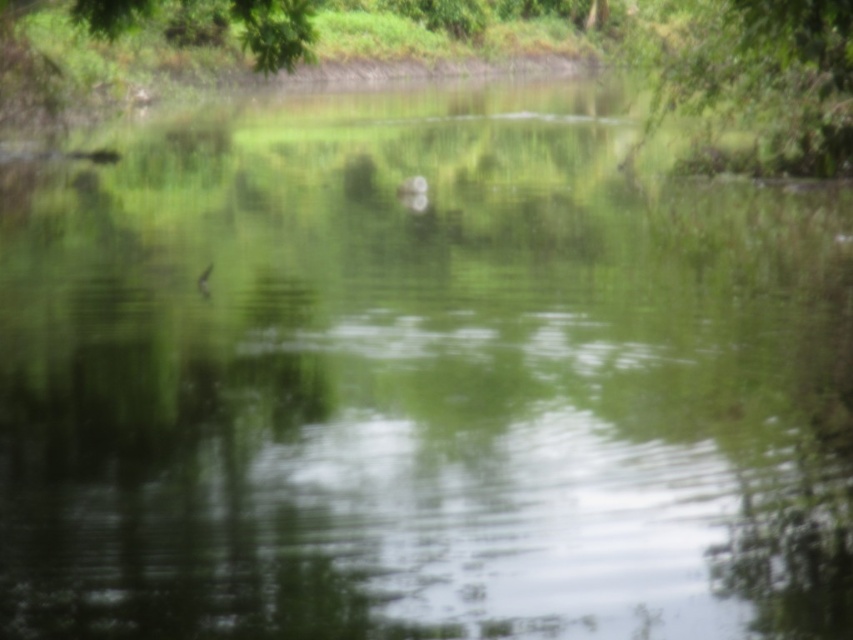
Question: Is green leafy tree at upper right smaller than green leafy tree at upper left?

Choices:
 (A) yes
 (B) no

Answer: (A)

Question: Considering the relative positions of green leafy tree at upper right and green leafy tree at upper left in the image provided, where is green leafy tree at upper right located with respect to green leafy tree at upper left?

Choices:
 (A) below
 (B) above

Answer: (A)

Question: Among these points, which one is nearest to the camera?

Choices:
 (A) (804, 122)
 (B) (245, 42)

Answer: (B)

Question: In this image, where is green leafy tree at upper right located relative to green leafy tree at upper left?

Choices:
 (A) right
 (B) left

Answer: (A)

Question: Which object is closer to the camera taking this photo?

Choices:
 (A) green leafy tree at upper left
 (B) green leafy tree at upper right

Answer: (B)